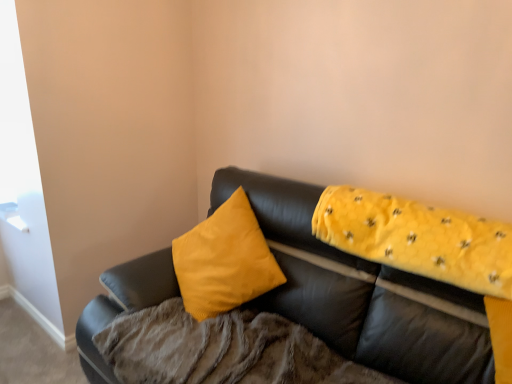
Question: Is matte black couch at center further to camera compared to yellow quilted fabric at upper right?

Choices:
 (A) no
 (B) yes

Answer: (A)

Question: Considering the relative positions of matte black couch at center and yellow quilted fabric at upper right in the image provided, is matte black couch at center to the right of yellow quilted fabric at upper right from the viewer's perspective?

Choices:
 (A) no
 (B) yes

Answer: (A)

Question: Is matte black couch at center surrounding yellow quilted fabric at upper right?

Choices:
 (A) yes
 (B) no

Answer: (A)

Question: Is matte black couch at center looking in the opposite direction of yellow quilted fabric at upper right?

Choices:
 (A) yes
 (B) no

Answer: (A)

Question: Considering the relative sizes of matte black couch at center and yellow quilted fabric at upper right in the image provided, is matte black couch at center thinner than yellow quilted fabric at upper right?

Choices:
 (A) no
 (B) yes

Answer: (A)

Question: From a real-world perspective, is matte black couch at center physically located above or below yellow quilted fabric at upper right?

Choices:
 (A) above
 (B) below

Answer: (B)

Question: From the image's perspective, relative to yellow quilted fabric at upper right, is matte black couch at center above or below?

Choices:
 (A) above
 (B) below

Answer: (B)

Question: Considering their positions, is matte black couch at center located in front of or behind yellow quilted fabric at upper right?

Choices:
 (A) front
 (B) behind

Answer: (A)

Question: In terms of height, does matte black couch at center look taller or shorter compared to yellow quilted fabric at upper right?

Choices:
 (A) tall
 (B) short

Answer: (A)

Question: From the image's perspective, is soft yellow blanket at upper right located above or below yellow quilted fabric at upper right?

Choices:
 (A) below
 (B) above

Answer: (A)

Question: Is soft yellow blanket at upper right bigger or smaller than yellow quilted fabric at upper right?

Choices:
 (A) big
 (B) small

Answer: (A)

Question: Is soft yellow blanket at upper right to the left or to the right of yellow quilted fabric at upper right in the image?

Choices:
 (A) left
 (B) right

Answer: (A)

Question: Do you think soft yellow blanket at upper right is within yellow quilted fabric at upper right, or outside of it?

Choices:
 (A) inside
 (B) outside

Answer: (B)

Question: Looking at their shapes, would you say yellow quilted fabric at upper right is wider or thinner than matte black couch at center?

Choices:
 (A) thin
 (B) wide

Answer: (A)

Question: Based on their positions, is yellow quilted fabric at upper right located to the left or right of matte black couch at center?

Choices:
 (A) left
 (B) right

Answer: (B)